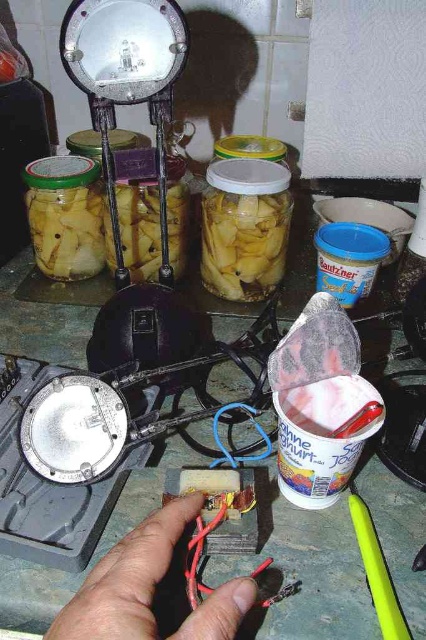
You are standing in front of the workspace and want to reach the point that is closer to you. Which point should you go to, point (117,637) or point (271,266)?

Point (117,637) is in front of point (271,266), so you should go to point (117,637) as it is closer to you.